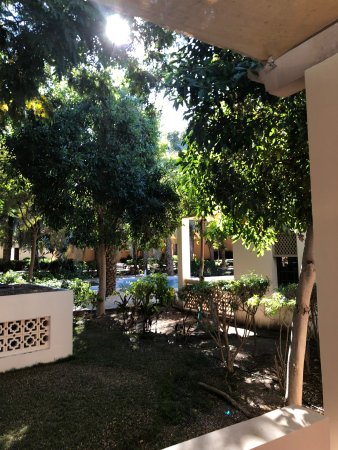
At what (x,y) coordinates should I click in order to perform the action: click on wall. Please return your answer as a coordinate pair (x, y). This screenshot has width=338, height=450. Looking at the image, I should click on (30, 335), (55, 309).